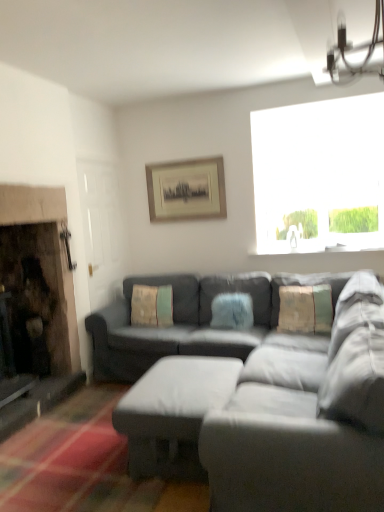
Image resolution: width=384 pixels, height=512 pixels. I want to click on free space above matte gray ottoman at center (from a real-world perspective), so click(x=191, y=381).